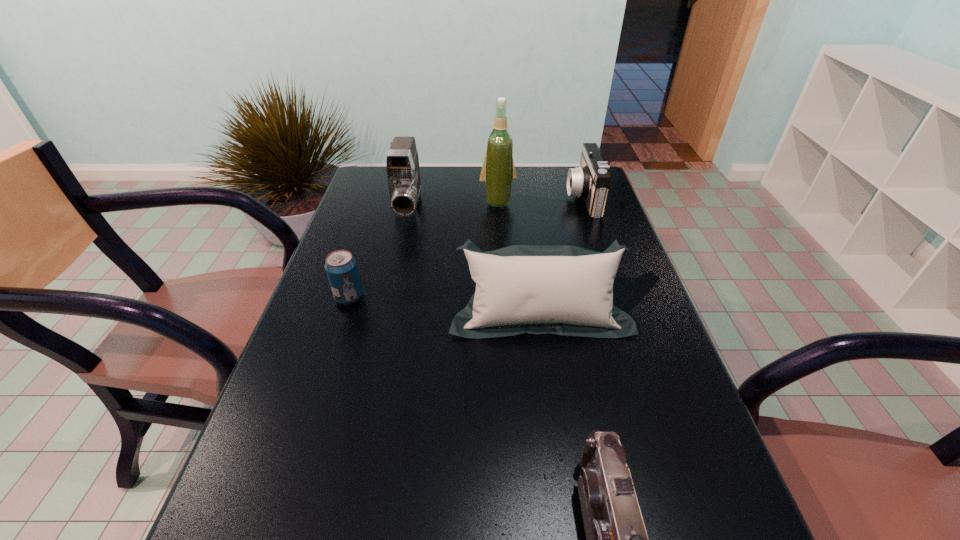
Identify the location of the tallest object. The image size is (960, 540). (498, 171).

The width and height of the screenshot is (960, 540). I want to click on the leftmost camcorder, so click(402, 165).

Locate an element on the screen. the tallest camcorder is located at coordinates (402, 165).

This screenshot has height=540, width=960. What are the coordinates of `cushion` in the screenshot? It's located at (566, 290).

Locate an element on the screen. the second tallest camcorder is located at coordinates (591, 180).

Where is `pop soda`? pop soda is located at coordinates (341, 268).

Locate an element on the screen. vacant space located 0.340m on the front-facing side of the wine bottle is located at coordinates point(502,285).

Identify the location of vacant area located 0.190m at the front of the fifth shortest object, highlighting the lens. (394, 272).

The width and height of the screenshot is (960, 540). Identify the location of vacant space positioned on the surface of the cushion. (560, 453).

This screenshot has width=960, height=540. Find the location of `vacant position located 0.310m on the lens of the rightmost camcorder`. vacant position located 0.310m on the lens of the rightmost camcorder is located at coordinates (470, 198).